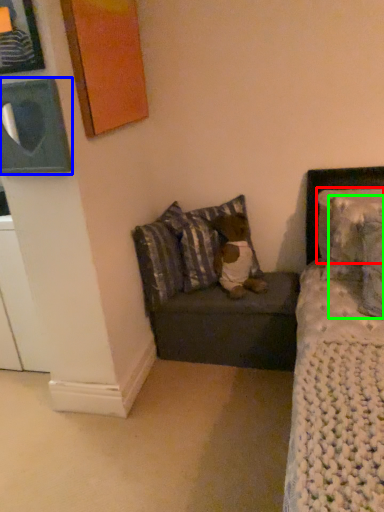
Question: Estimate the real-world distances between objects in this image. Which object is farther from pillow (highlighted by a red box), picture frame (highlighted by a blue box) or pillow (highlighted by a green box)?

Choices:
 (A) picture frame
 (B) pillow

Answer: (A)